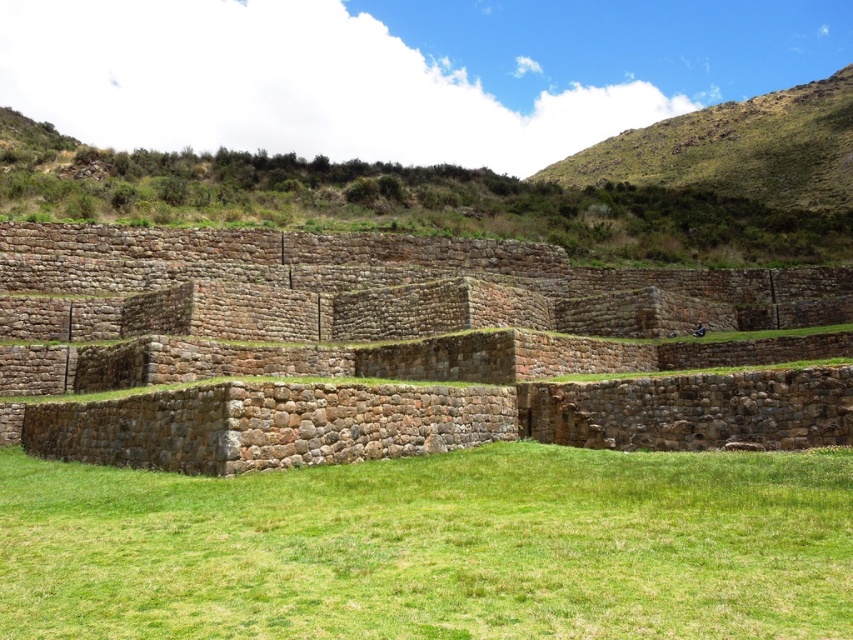
Question: Which object is positioned farthest from the green grass at center?

Choices:
 (A) green grassy hillside at upper right
 (B) brown stone wall at upper center
 (C) brown stone amphitheater at center

Answer: (A)

Question: Which object is the farthest from the green grass at center?

Choices:
 (A) brown stone wall at upper center
 (B) brown stone amphitheater at center
 (C) green grassy hillside at upper right

Answer: (C)

Question: Can you confirm if green grass at center is positioned to the right of green grassy hillside at upper right?

Choices:
 (A) no
 (B) yes

Answer: (A)

Question: Estimate the real-world distances between objects in this image. Which object is closer to the brown stone amphitheater at center?

Choices:
 (A) green grass at center
 (B) brown stone wall at upper center
 (C) green grassy hillside at upper right

Answer: (A)

Question: Can you confirm if brown stone amphitheater at center is smaller than brown stone wall at upper center?

Choices:
 (A) no
 (B) yes

Answer: (B)

Question: Can you confirm if brown stone amphitheater at center is thinner than green grassy hillside at upper right?

Choices:
 (A) no
 (B) yes

Answer: (B)